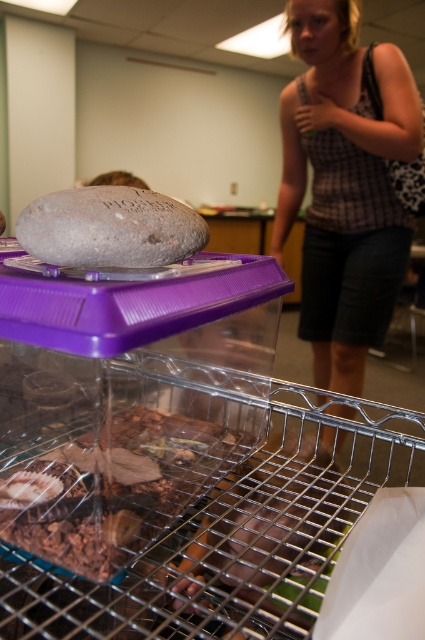
You are standing in a classroom and see the plaid fabric tank top at upper right. If you want to grab it, can you reach it without moving your feet?

The plaid fabric tank top at upper right is 5.93 feet from viewer, which is approximately 71 inches. Since the average human arm length is about 25 to 30 inches, you cannot reach it without moving your feet.

You are standing in the classroom and want to determine which of the two points, point (x=36, y=547) or point (x=74, y=220), is closer to you. Based on the scene, which point is nearer?

Point (x=36, y=547) is closer to you because it is further to the viewer than point (x=74, y=220).

You are standing in a classroom and see the point at coordinates (x=343, y=186). What object is located at that position?

The point at coordinates (x=343, y=186) indicates the plaid fabric tank top at upper right.